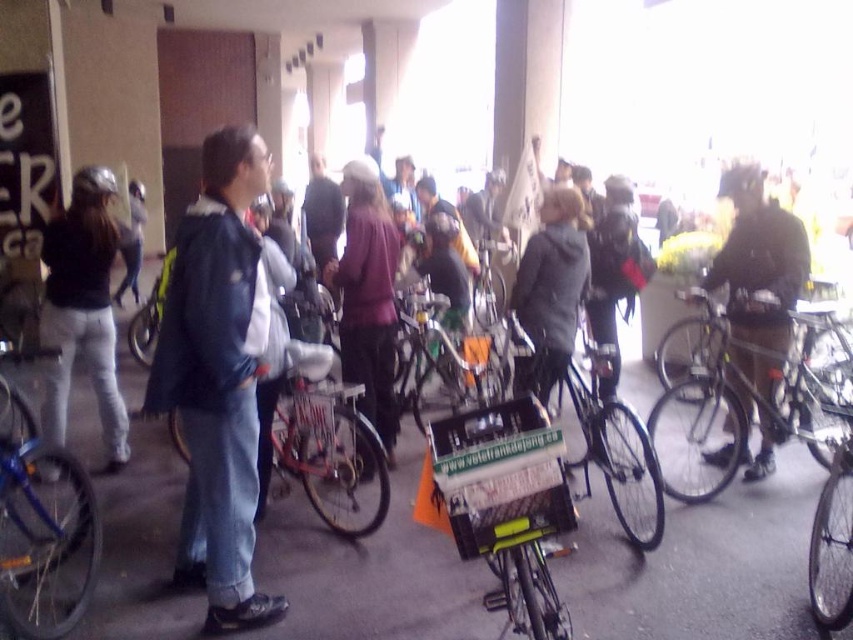
You are a photographer trying to capture a candid shot of the dark gray jacket at left and the dark gray helmet at right. Since you want to ensure both are in focus, you need to know which object is taller. Which one is taller?

The dark gray helmet at right is taller than the dark gray jacket at left according to the description.

You are a photographer standing at the camera position. You want to take a photo of the shiny metallic bicycle at center. However, you have a 2.5 meter long extension pole to reach further. Will the pole be sufficient to reach the bicycle?

The shiny metallic bicycle at center is 3.17 meters from the camera. The extension pole is 2.5 meters long, which is shorter than the distance required. Therefore, the pole will not be sufficient to reach the bicycle.

You are a photographer at the event and want to capture both the dark gray jacket at left and the dark gray helmet at right in a single photo. Based on their positions, which object should you focus on first to ensure both are in frame?

The dark gray jacket at left is below the dark gray helmet at right, so focusing on the helmet first and adjusting the camera angle downward will ensure both are in frame.